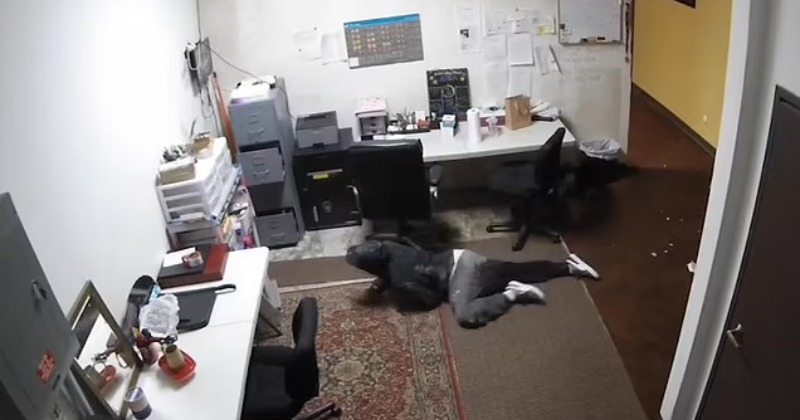
Where is `trashcan`? trashcan is located at coordinates (598, 158).